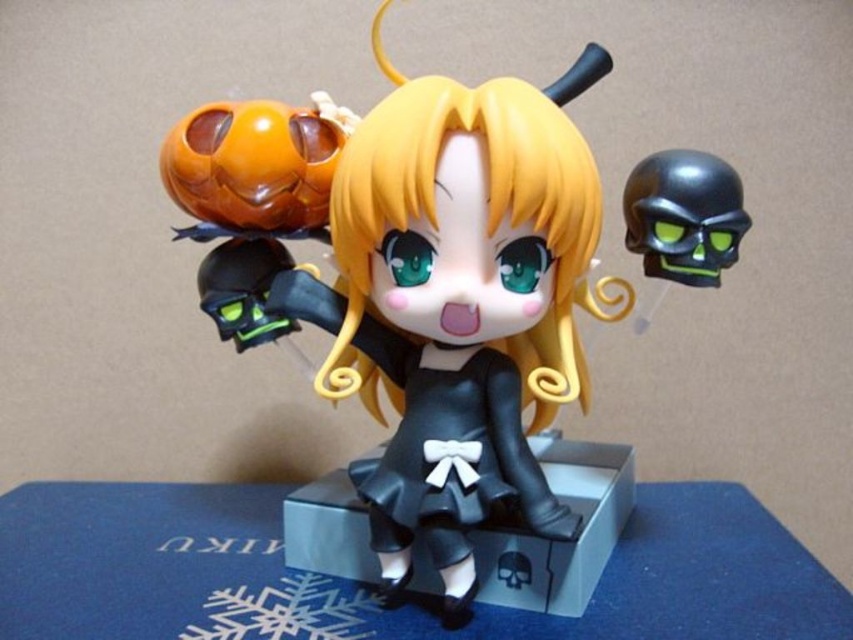
You are a collector arranging Halloween decorations. You have a matte black figure at center and a black matte skull at upper right. Based on their positions, which object is closer to the left side of the display?

The matte black figure at center is closer to the left side of the display because it is positioned to the left of the black matte skull at upper right.

Based on the photo, you are a photographer adjusting your camera to focus on two specific points in the image. The first point is point (430, 355) and the second is point (723, 209). Which point should you focus on first if you want to capture the closest object to the camera?

Point (430, 355) is further to the camera than point (723, 209), so you should focus on point (430, 355) first as it is closer to the camera.